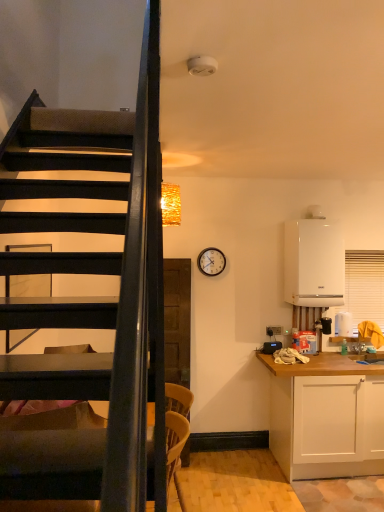
What do you see at coordinates (364, 286) in the screenshot? This screenshot has width=384, height=512. I see `white blinds at right` at bounding box center [364, 286].

Describe the element at coordinates (174, 442) in the screenshot. Image resolution: width=384 pixels, height=512 pixels. I see `light brown woven chair at lower center` at that location.

Image resolution: width=384 pixels, height=512 pixels. In order to click on light brown woven chair at lower center in this screenshot , I will do `click(174, 442)`.

Locate an element on the screen. The image size is (384, 512). white glossy boiler at right is located at coordinates (314, 263).

What is the approximate height of wooden clock at upper center?

The height of wooden clock at upper center is 11.30 inches.

Identify the location of white matte cabinet at lower right. The width and height of the screenshot is (384, 512). (325, 416).

Considering the relative sizes of white blinds at right and white matte cabinet at lower right in the image provided, is white blinds at right shorter than white matte cabinet at lower right?

Correct, white blinds at right is not as tall as white matte cabinet at lower right.

Is white matte cabinet at lower right surrounded by white blinds at right?

No, white matte cabinet at lower right is not a part of white blinds at right.

Is white blinds at right wider than white matte cabinet at lower right?

No, white blinds at right is not wider than white matte cabinet at lower right.

How distant is light brown woven chair at lower center from white glossy boiler at right?

They are 1.93 meters apart.

Is the depth of light brown woven chair at lower center greater than that of white glossy boiler at right?

That is False.

How different are the orientations of light brown woven chair at lower center and white glossy boiler at right in degrees?

The angular difference between light brown woven chair at lower center and white glossy boiler at right is 90 degrees.

Considering the sizes of objects light brown woven chair at lower center and white glossy boiler at right in the image provided, who is shorter, light brown woven chair at lower center or white glossy boiler at right?

With less height is light brown woven chair at lower center.

Does white matte cabinet at lower right come behind white blinds at right?

That is False.

Identify the location of cabinetry on the left of white blinds at right. (325, 416).

In the scene shown: Between white matte cabinet at lower right and white blinds at right, which one has larger size?

With larger size is white matte cabinet at lower right.

Considering the sizes of objects white matte cabinet at lower right and white blinds at right in the image provided, who is taller, white matte cabinet at lower right or white blinds at right?

With more height is white matte cabinet at lower right.

From the image's perspective, is white blinds at right located above wooden clock at upper center?

No.

Is white blinds at right outside of wooden clock at upper center?

white blinds at right is positioned outside wooden clock at upper center.

You are a GUI agent. You are given a task and a screenshot of the screen. Output one action in this format:
    pyautogui.click(x=<x>, y=<y>)
    Task: Click on the clock located in front of the white blinds at right
    
    Given the screenshot: What is the action you would take?
    pyautogui.click(x=211, y=261)

Can you confirm if white blinds at right is taller than wooden clock at upper center?

Correct, white blinds at right is much taller as wooden clock at upper center.

Which of these two, wooden clock at upper center or light brown woven chair at lower center, is smaller?

wooden clock at upper center.

Is wooden clock at upper center to the right of light brown woven chair at lower center from the viewer's perspective?

Indeed, wooden clock at upper center is positioned on the right side of light brown woven chair at lower center.

Are wooden clock at upper center and light brown woven chair at lower center located far from each other?

wooden clock at upper center is far away from light brown woven chair at lower center.

Based on the photo, which point is more distant from viewer, (378, 303) or (309, 267)?

The point (378, 303) is farther.

How far apart are white blinds at right and white glossy boiler at right?

white blinds at right and white glossy boiler at right are 20.72 inches apart.

In the scene shown: Is white blinds at right outside of white glossy boiler at right?

Indeed, white blinds at right is completely outside white glossy boiler at right.

From the image's perspective, is white blinds at right above white glossy boiler at right?

Incorrect, from the image's perspective, white blinds at right is lower than white glossy boiler at right.

In the image, there is a white glossy boiler at right. What are the coordinates of `window screen below it (from the image's perspective)` in the screenshot? It's located at [x=364, y=286].

How many degrees apart are the facing directions of white glossy boiler at right and white blinds at right?

The angular difference between white glossy boiler at right and white blinds at right is 0.00349 degrees.

Considering the relative sizes of white glossy boiler at right and white blinds at right in the image provided, is white glossy boiler at right shorter than white blinds at right?

Yes.

Considering the positions of objects white glossy boiler at right and white blinds at right in the image provided, who is more to the right, white glossy boiler at right or white blinds at right?

Positioned to the right is white blinds at right.

Locate an element on the screen. The image size is (384, 512). cabinetry below the white blinds at right (from a real-world perspective) is located at coordinates (325, 416).

The width and height of the screenshot is (384, 512). Find the location of `appliance that is on the right side of light brown woven chair at lower center`. appliance that is on the right side of light brown woven chair at lower center is located at coordinates (314, 263).

Considering their positions, is white glossy boiler at right positioned closer to white blinds at right than light brown woven chair at lower center?

The object closer to white blinds at right is white glossy boiler at right.

When comparing their distances from white blinds at right, does light brown woven chair at lower center or wooden clock at upper center seem closer?

wooden clock at upper center is positioned closer to the anchor white blinds at right.

Estimate the real-world distances between objects in this image. Which object is closer to white glossy boiler at right, white blinds at right or light brown woven chair at lower center?

Based on the image, white blinds at right appears to be nearer to white glossy boiler at right.

Which object lies further to the anchor point white glossy boiler at right, white blinds at right or white matte cabinet at lower right?

white matte cabinet at lower right.

Based on their spatial positions, is white glossy boiler at right or white blinds at right closer to wooden clock at upper center?

Among the two, white glossy boiler at right is located nearer to wooden clock at upper center.

Looking at the image, which one is located further to white glossy boiler at right, white matte cabinet at lower right or white blinds at right?

white matte cabinet at lower right is further to white glossy boiler at right.

Based on their spatial positions, is white blinds at right or wooden clock at upper center closer to white glossy boiler at right?

Among the two, white blinds at right is located nearer to white glossy boiler at right.

Considering their positions, is white matte cabinet at lower right positioned further to light brown woven chair at lower center than white blinds at right?

white blinds at right lies further to light brown woven chair at lower center than the other object.

What are the coordinates of `appliance that lies between wooden clock at upper center and white matte cabinet at lower right from top to bottom` in the screenshot? It's located at (314, 263).

The width and height of the screenshot is (384, 512). I want to click on cabinetry between wooden clock at upper center and white blinds at right in the horizontal direction, so click(325, 416).

Where is `window screen between white glossy boiler at right and white matte cabinet at lower right in the vertical direction`? window screen between white glossy boiler at right and white matte cabinet at lower right in the vertical direction is located at coordinates (364, 286).

Where is `cabinetry located between light brown woven chair at lower center and wooden clock at upper center in the depth direction`? This screenshot has width=384, height=512. cabinetry located between light brown woven chair at lower center and wooden clock at upper center in the depth direction is located at coordinates (325, 416).